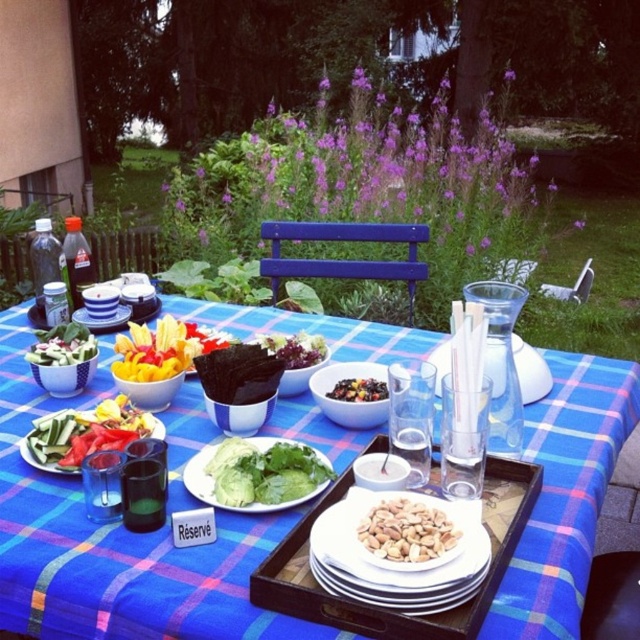
You are planning to grab both the bright red pepper at center and the shiny dark chocolate at center from the table. If your hand can reach 16 inches in one stretch, can you pick them up without moving your arm?

The bright red pepper at center and the shiny dark chocolate at center are 15.55 inches apart from each other. Since your reach is 16 inches, which is slightly longer than the distance between them, you can pick them up without moving your arm.

You are a guest at a picnic and want to grab the green leafy salad at center. However, there is a bright red pepper at center in the way. Can you reach the salad without moving the pepper?

The bright red pepper at center is positioned over green leafy salad at center, so you can reach the salad by moving the pepper aside first.